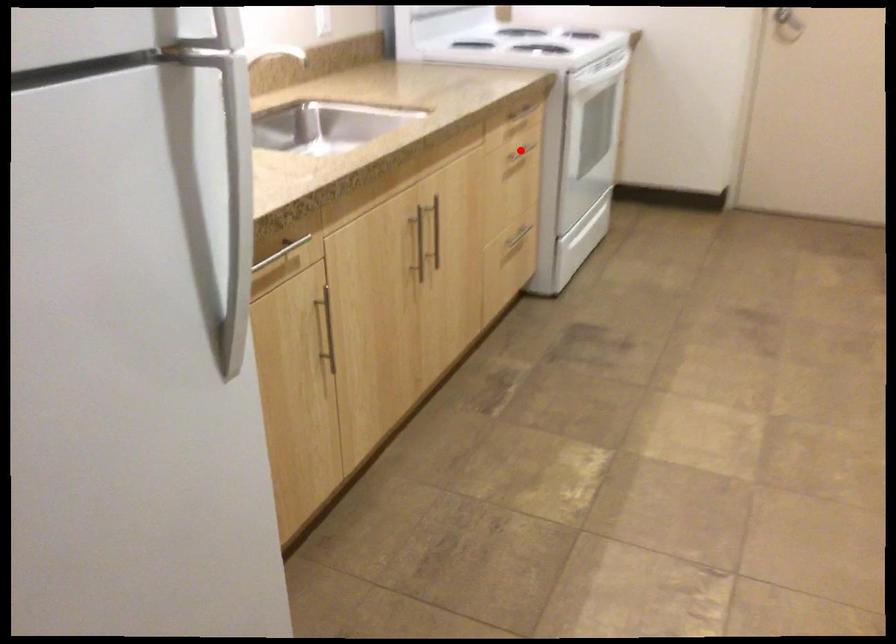
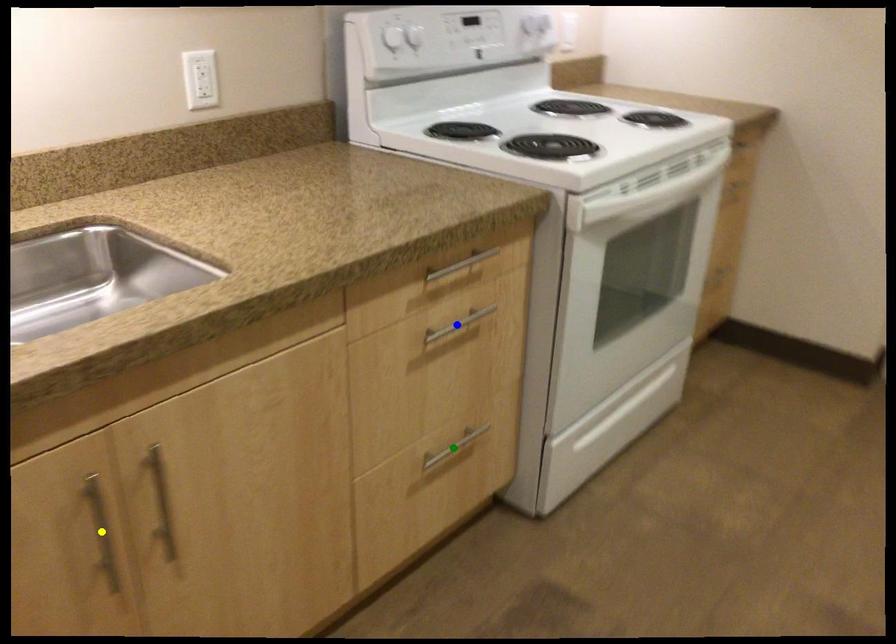
Question: I am providing you with two images of the same scene from different viewpoints. A red point is marked on the first image. You are given multiple points on the second image. Which point in image 2 is actually the same real-world point as the red point in image 1?

Choices:
 (A) green point
 (B) yellow point
 (C) blue point

Answer: (C)